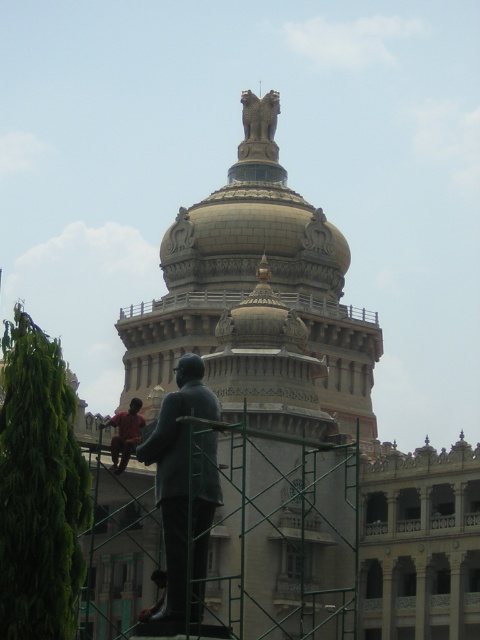
You are a tour guide explaining the image to visitors. You mention the bronze statue at upper center and the red shirt at lower left. Which object is narrower in width?

The bronze statue at upper center is narrower in width than the red shirt at lower left.